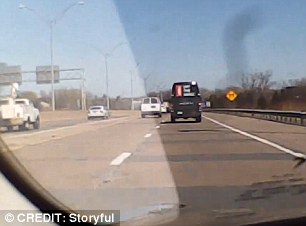
Identify the location of window reflection. The width and height of the screenshot is (306, 226). (268, 198).